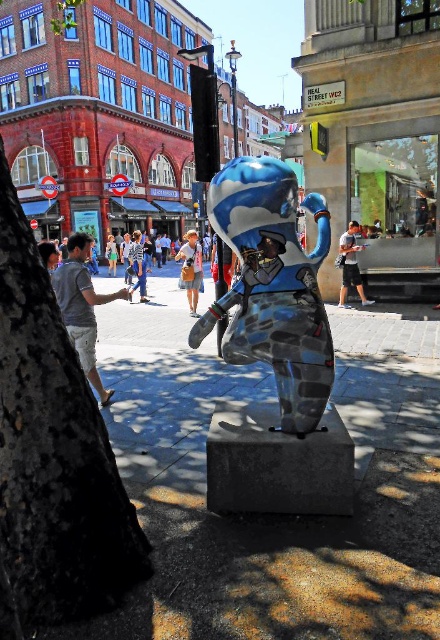
Who is positioned more to the right, dark brown bark at left or blue denim jeans at center?

dark brown bark at left is more to the right.

Can you confirm if dark brown bark at left is positioned to the left of blue denim jeans at center?

Incorrect, dark brown bark at left is not on the left side of blue denim jeans at center.

Who is more distant from viewer, [43,316] or [132,248]?

Positioned behind is point [132,248].

Identify the location of dark brown bark at left. This screenshot has height=640, width=440. (52, 456).

Does point (62, 269) come closer to viewer compared to point (363, 294)?

Yes.

Between gray cotton t-shirt at left and matte blue and white sculpture at center, which one has less height?

With less height is gray cotton t-shirt at left.

Which is in front, point (72, 248) or point (345, 262)?

Positioned in front is point (72, 248).

The height and width of the screenshot is (640, 440). In order to click on gray cotton t-shirt at left in this screenshot , I will do `click(81, 307)`.

Does dark brown bark at left appear on the left side of denim skirt at center?

In fact, dark brown bark at left is to the right of denim skirt at center.

Can you confirm if dark brown bark at left is smaller than denim skirt at center?

Yes, dark brown bark at left is smaller than denim skirt at center.

In order to click on dark brown bark at left in this screenshot , I will do `click(52, 456)`.